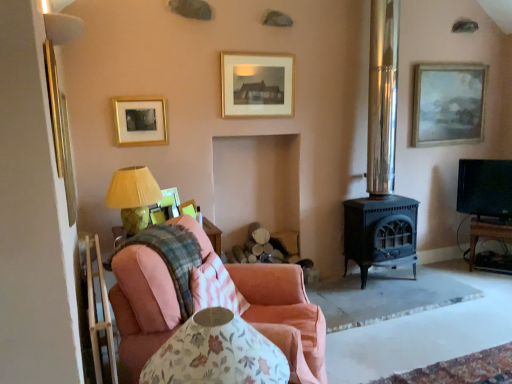
Identify the location of wooden tv stand at right. [x=485, y=235].

In order to face gold/glossy picture frame at upper left, which is the 3th picture frame from front to back, should I rotate leftwards or rightwards?

You should rotate left by 14.881 degrees.

The width and height of the screenshot is (512, 384). What do you see at coordinates (381, 161) in the screenshot?
I see `polished metal stove at center-right` at bounding box center [381, 161].

Describe the element at coordinates (284, 316) in the screenshot. I see `pink fabric couch at lower left` at that location.

Measure the distance between gold-framed print at upper center, which is the fourth picture frame in front-to-back order, and camera.

gold-framed print at upper center, which is the fourth picture frame in front-to-back order, and camera are 10.31 feet apart from each other.

Describe the element at coordinates (133, 196) in the screenshot. The height and width of the screenshot is (384, 512). I see `matte yellow fabric at left` at that location.

This screenshot has height=384, width=512. What do you see at coordinates (485, 187) in the screenshot?
I see `black glossy tv at right` at bounding box center [485, 187].

Locate an element on the screen. wooden tv stand at right is located at coordinates (485, 235).

Is there a large distance between gold/glossy picture frame at upper left, the second picture frame positioned from the left, and pink fabric chair at lower left?

Yes, gold/glossy picture frame at upper left, the second picture frame positioned from the left, is far from pink fabric chair at lower left.

Is gold/glossy picture frame at upper left, the second picture frame positioned from the left, positioned with its back to pink fabric chair at lower left?

No, pink fabric chair at lower left is not at the back of gold/glossy picture frame at upper left, the second picture frame positioned from the left.

Between gold/glossy picture frame at upper left, which is the 3th picture frame from front to back, and pink fabric chair at lower left, which one is positioned in front?

pink fabric chair at lower left is closer to the camera.

From the image's perspective, would you say gold/glossy picture frame at upper left, the second picture frame positioned from the left, is shown under pink fabric chair at lower left?

Actually, gold/glossy picture frame at upper left, the second picture frame positioned from the left, appears above pink fabric chair at lower left in the image.

From the image's perspective, between pink fabric chair at lower left and gold/glossy picture frame at upper left, acting as the 4th picture frame starting from the right, which one is located above?

gold/glossy picture frame at upper left, acting as the 4th picture frame starting from the right, appears higher in the image.

Is pink fabric chair at lower left far away from gold/glossy picture frame at upper left, which is the 3th picture frame from front to back?

Indeed, pink fabric chair at lower left is not near gold/glossy picture frame at upper left, which is the 3th picture frame from front to back.

Is gold/glossy picture frame at upper left, which is the 3th picture frame from front to back, located within pink fabric chair at lower left?

No, gold/glossy picture frame at upper left, which is the 3th picture frame from front to back, is not inside pink fabric chair at lower left.

Between pink fabric chair at lower left and gold/glossy picture frame at upper left, acting as the 4th picture frame starting from the right, which one has larger size?

With larger size is pink fabric chair at lower left.

Is pink fabric chair at lower left far from pink fabric couch at lower left?

No.

From the image's perspective, is pink fabric chair at lower left above or below pink fabric couch at lower left?

From the image's perspective, pink fabric chair at lower left appears below pink fabric couch at lower left.

From a real-world perspective, which is physically below, pink fabric chair at lower left or pink fabric couch at lower left?

In real-world perspective, pink fabric couch at lower left is lower.

Does pink cotton pillow at center appear on the right side of gold-framed print at upper center, which is the fourth picture frame in front-to-back order?

Incorrect, pink cotton pillow at center is not on the right side of gold-framed print at upper center, which is the fourth picture frame in front-to-back order.

Considering the relative sizes of pink cotton pillow at center and gold-framed print at upper center, the 2th picture frame in the back-to-front sequence, in the image provided, is pink cotton pillow at center taller than gold-framed print at upper center, the 2th picture frame in the back-to-front sequence,?

No.

Is pink cotton pillow at center turned away from gold-framed print at upper center, which is the 4th picture frame in left-to-right order?

pink cotton pillow at center does not have its back to gold-framed print at upper center, which is the 4th picture frame in left-to-right order.

In the scene shown: Based on their sizes in the image, would you say pink cotton pillow at center is bigger or smaller than gold-framed print at upper center, which is the fourth picture frame in front-to-back order?

pink cotton pillow at center is bigger than gold-framed print at upper center, which is the fourth picture frame in front-to-back order.

From the image's perspective, is gold/glossy picture frame at upper left, placed as the third picture frame when sorted from back to front, over gold-framed print at upper center, the second picture frame positioned from the right?

Incorrect, from the image's perspective, gold/glossy picture frame at upper left, placed as the third picture frame when sorted from back to front, is lower than gold-framed print at upper center, the second picture frame positioned from the right.

Is gold/glossy picture frame at upper left, acting as the 4th picture frame starting from the right, located outside gold-framed print at upper center, the second picture frame positioned from the right?

Yes, gold/glossy picture frame at upper left, acting as the 4th picture frame starting from the right, is not within gold-framed print at upper center, the second picture frame positioned from the right.

Can you confirm if gold/glossy picture frame at upper left, which is the 3th picture frame from front to back, is positioned to the left of gold-framed print at upper center, the 2th picture frame in the back-to-front sequence?

Indeed, gold/glossy picture frame at upper left, which is the 3th picture frame from front to back, is positioned on the left side of gold-framed print at upper center, the 2th picture frame in the back-to-front sequence.

Is wooden tv stand at right positioned behind matte yellow fabric at left?

Yes, the depth of wooden tv stand at right is greater than that of matte yellow fabric at left.

Is wooden tv stand at right to the left of matte yellow fabric at left from the viewer's perspective?

Incorrect, wooden tv stand at right is not on the left side of matte yellow fabric at left.

Which object is wider, wooden tv stand at right or matte yellow fabric at left?

wooden tv stand at right is wider.

Which is behind, point (497, 160) or point (82, 26)?

The point (497, 160) is behind.

Would you say black glossy tv at right contains white fabric lampshade at upper left?

No, white fabric lampshade at upper left is not surrounded by black glossy tv at right.

Find the location of `television behind the white fabric lampshade at upper left`. television behind the white fabric lampshade at upper left is located at coordinates (485, 187).

Image resolution: width=512 pixels, height=384 pixels. Find the location of `the 1st picture frame to the left when counting from the pink fabric chair at lower left`. the 1st picture frame to the left when counting from the pink fabric chair at lower left is located at coordinates (140, 120).

At what (x,y) coordinates should I click in order to perform the action: click on chair that is below the gold/glossy picture frame at upper left, acting as the 4th picture frame starting from the right (from the image's perspective). Please return your answer as a coordinate pair (x, y). Looking at the image, I should click on (96, 314).

Considering their positions, is gold-framed print at upper center, the 2th picture frame in the back-to-front sequence, positioned closer to wooden tv stand at right than matte gold picture frame at upper right, which is the 1th picture frame from right to left?

matte gold picture frame at upper right, which is the 1th picture frame from right to left, lies closer to wooden tv stand at right than the other object.

When comparing their distances from gold/glossy picture frame at upper left, placed as the third picture frame when sorted from back to front, does gold-framed print at upper center, which is the fourth picture frame in front-to-back order, or matte yellow fabric at left seem further?

gold-framed print at upper center, which is the fourth picture frame in front-to-back order, is positioned further to the anchor gold/glossy picture frame at upper left, placed as the third picture frame when sorted from back to front.

Based on their spatial positions, is gold metallic picture frame at left, which appears as the first picture frame when viewed from the front, or matte yellow fabric at left further from black glossy tv at right?

gold metallic picture frame at left, which appears as the first picture frame when viewed from the front, is positioned further to the anchor black glossy tv at right.

From the image, which object appears to be nearer to metallic gold picture frame at left, the first picture frame positioned from the left, pink fabric couch at lower left or matte gold picture frame at upper right, which is the 1th picture frame from right to left?

pink fabric couch at lower left.

Looking at the image, which one is located further to matte gold picture frame at upper right, which is the 5th picture frame from front to back, white fabric lampshade at upper left or polished metal stove at center-right?

white fabric lampshade at upper left lies further to matte gold picture frame at upper right, which is the 5th picture frame from front to back, than the other object.

Considering their positions, is pink cotton pillow at center positioned closer to white fabric lampshade at upper left than gold-framed print at upper center, which is the fourth picture frame in front-to-back order?

Among the two, pink cotton pillow at center is located nearer to white fabric lampshade at upper left.

When comparing their distances from white fabric lampshade at upper left, does gold-framed print at upper center, which is the fourth picture frame in front-to-back order, or pink cotton pillow at center seem closer?

Based on the image, pink cotton pillow at center appears to be nearer to white fabric lampshade at upper left.

Considering their positions, is polished metal stove at center-right positioned further to wooden tv stand at right than black glossy tv at right?

Among the two, polished metal stove at center-right is located further to wooden tv stand at right.

Image resolution: width=512 pixels, height=384 pixels. Identify the location of table lamp between white fabric lampshade at upper left and black glossy tv at right from left to right. [133, 196].

Locate an element on the screen. fireplace between pink cotton pillow at center and black glossy tv at right from left to right is located at coordinates (381, 161).

Locate an element on the screen. studio couch between pink fabric chair at lower left and gold/glossy picture frame at upper left, acting as the 4th picture frame starting from the right, from front to back is located at coordinates (284, 316).

The width and height of the screenshot is (512, 384). In order to click on table lamp between gold/glossy picture frame at upper left, the second picture frame positioned from the left, and wooden tv stand at right, in the horizontal direction in this screenshot , I will do `click(133, 196)`.